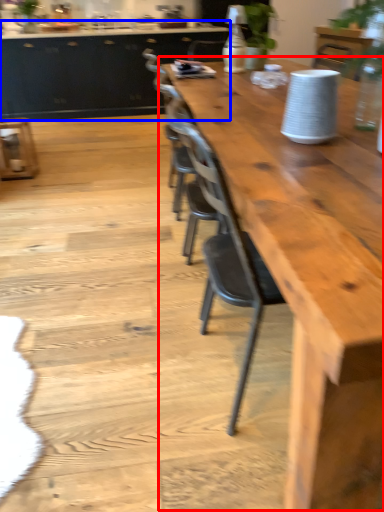
Question: Which of the following is the closest to the observer, table (highlighted by a red box) or cabinetry (highlighted by a blue box)?

Choices:
 (A) table
 (B) cabinetry

Answer: (A)